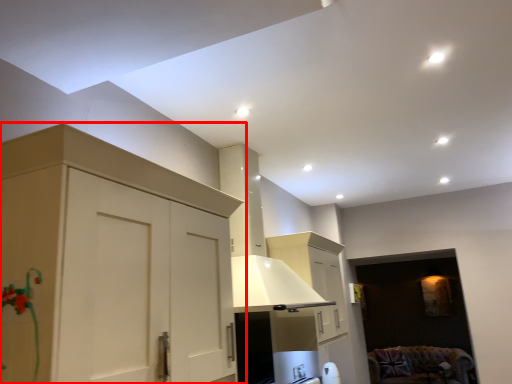
Question: Considering the relative positions of cabinetry (annotated by the red box) and furniture in the image provided, where is cabinetry (annotated by the red box) located with respect to the staircase?

Choices:
 (A) left
 (B) right

Answer: (A)